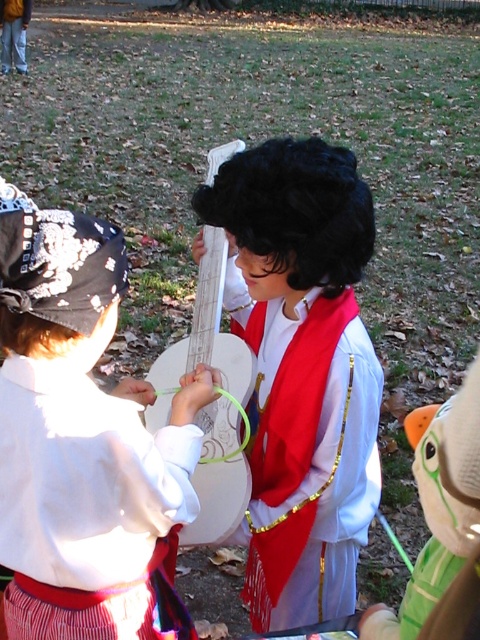
Question: Which point is farther from the camera taking this photo?

Choices:
 (A) (266, 147)
 (B) (151, 630)

Answer: (A)

Question: Which object appears farthest from the camera in this image?

Choices:
 (A) matte black wig at center
 (B) white cotton shirt at upper left

Answer: (A)

Question: Does white cotton shirt at upper left appear on the right side of matte black wig at center?

Choices:
 (A) yes
 (B) no

Answer: (B)

Question: Does white cotton shirt at upper left have a larger size compared to matte black wig at center?

Choices:
 (A) yes
 (B) no

Answer: (B)

Question: Does white cotton shirt at upper left appear on the right side of matte black wig at center?

Choices:
 (A) yes
 (B) no

Answer: (B)